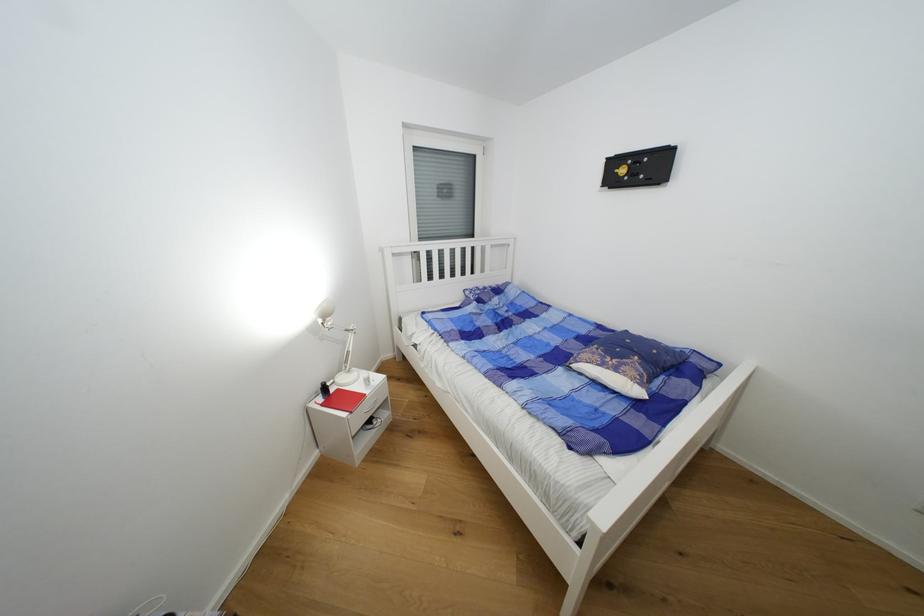
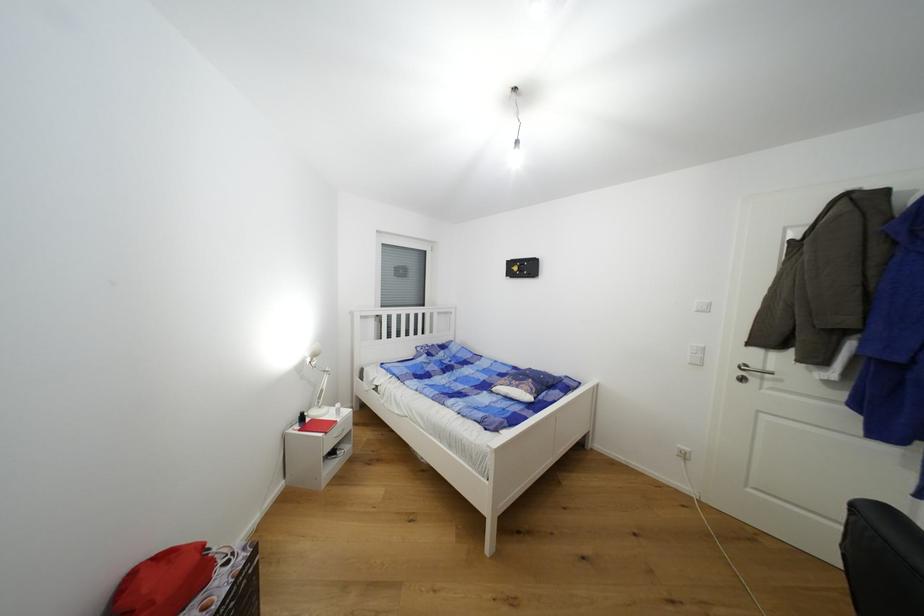
Question: The images are taken continuously from a first-person perspective. In which direction are you moving?

Choices:
 (A) Left
 (B) Right
 (C) Forward
 (D) Backward

Answer: (D)